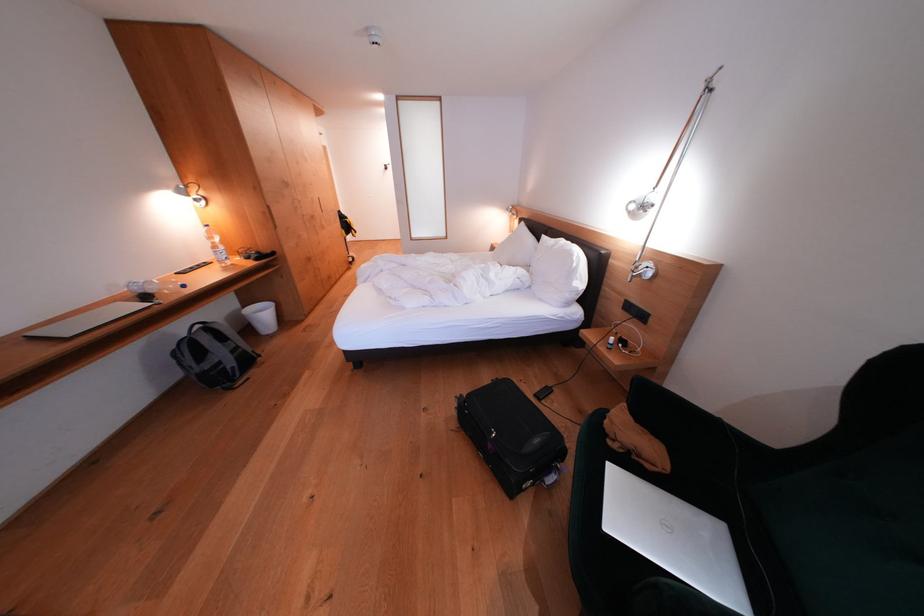
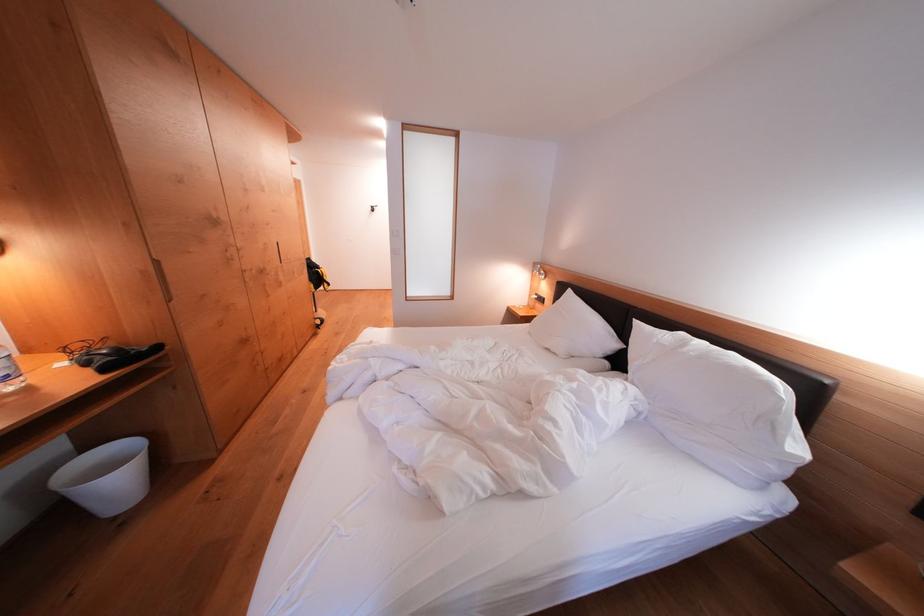
The point at (274,215) is marked in the first image. Where is the corresponding point in the second image?

(159, 274)